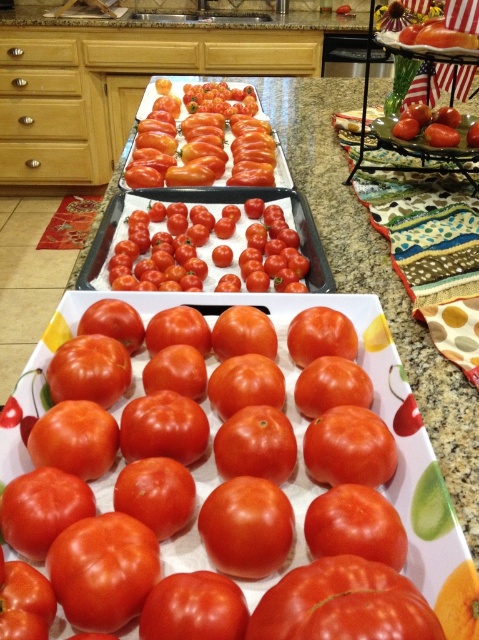
You are organizing a picnic and need to choose the largest tomato from the shiny red tomato at center and the shiny red tomatoes at center. Which one should you pick?

The shiny red tomatoes at center are larger in width compared to the shiny red tomato at center, so you should pick the shiny red tomatoes at center.

You are standing in front of the kitchen countertop and want to place a new tray of herbs exactly where the shiny red tomato at center currently is. Is this possible?

The shiny red tomato at center is located at coordinates (207,248), so yes, you can place the new tray of herbs there as long as you position it at those exact coordinates.